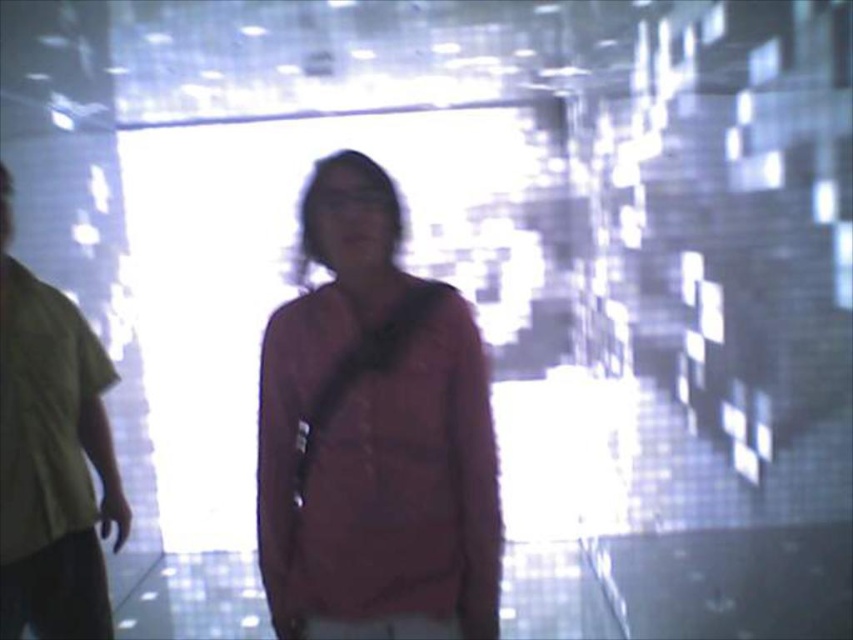
Question: Does matte red shirt at center have a smaller size compared to green fabric shirt at left?

Choices:
 (A) yes
 (B) no

Answer: (A)

Question: From the image, what is the correct spatial relationship of matte red shirt at center in relation to green fabric shirt at left?

Choices:
 (A) below
 (B) above

Answer: (B)

Question: Which point appears farthest from the camera in this image?

Choices:
 (A) (25, 493)
 (B) (283, 557)

Answer: (A)

Question: Among these objects, which one is farthest from the camera?

Choices:
 (A) green fabric shirt at left
 (B) matte red shirt at center

Answer: (A)

Question: Is matte red shirt at center smaller than green fabric shirt at left?

Choices:
 (A) no
 (B) yes

Answer: (B)